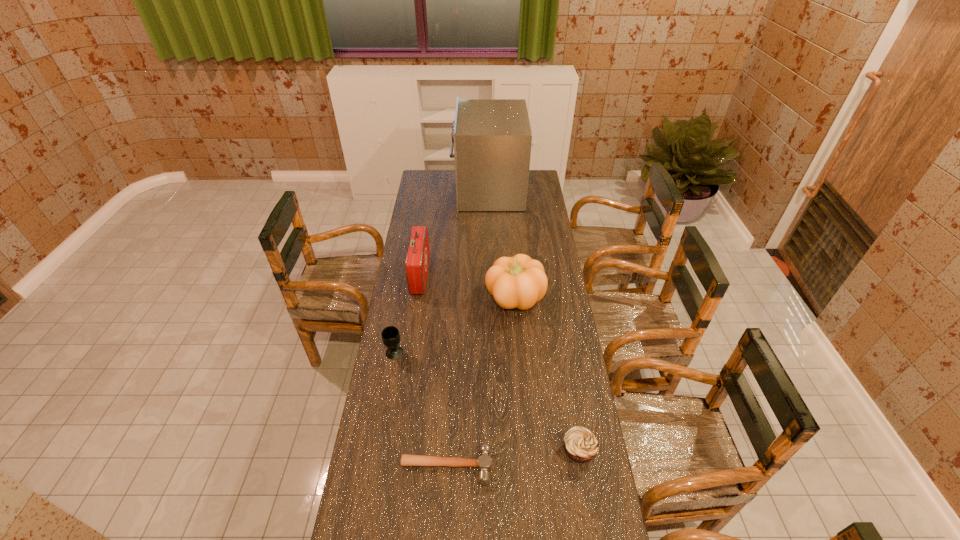
The image size is (960, 540). Identify the location of the farthest object. (492, 138).

I want to click on toaster oven, so click(492, 138).

Locate an element on the screen. The height and width of the screenshot is (540, 960). the first-aid kit is located at coordinates (417, 258).

This screenshot has width=960, height=540. Find the location of `pumpkin`. pumpkin is located at coordinates (519, 282).

Where is `the fourth farthest object`? The width and height of the screenshot is (960, 540). the fourth farthest object is located at coordinates (390, 335).

This screenshot has width=960, height=540. Find the location of `the fourth tallest object`. the fourth tallest object is located at coordinates tap(390, 335).

Where is `the fifth tallest object`? This screenshot has width=960, height=540. the fifth tallest object is located at coordinates (581, 444).

Locate an element on the screen. the shortest object is located at coordinates (483, 462).

Where is `free location located on the front panel of the farthest object`? This screenshot has height=540, width=960. free location located on the front panel of the farthest object is located at coordinates (430, 190).

The width and height of the screenshot is (960, 540). In order to click on vacant point located 0.050m on the front panel of the farthest object in this screenshot , I will do `click(445, 190)`.